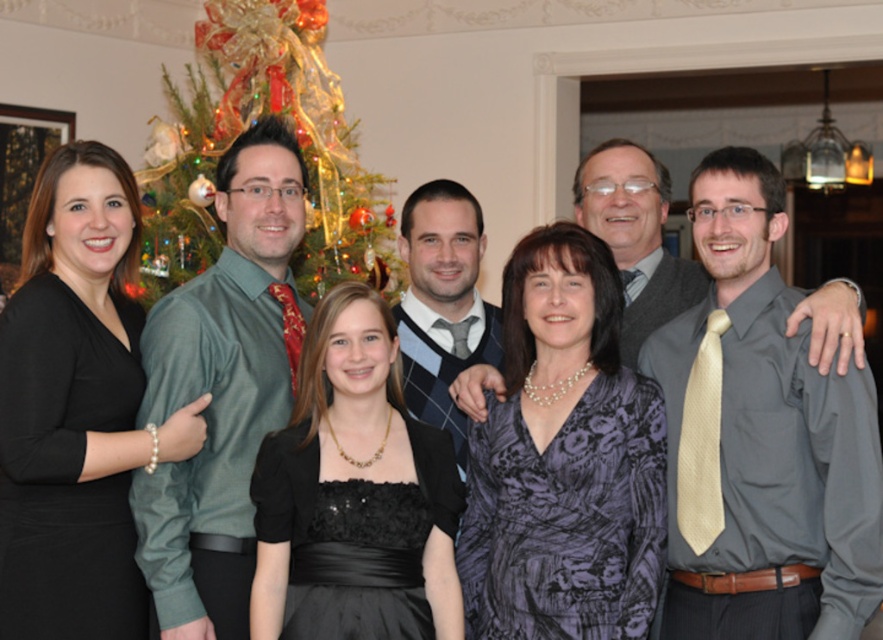
The width and height of the screenshot is (883, 640). What do you see at coordinates (223, 388) in the screenshot?
I see `green satin shirt at left` at bounding box center [223, 388].

Is green satin shirt at left positioned at the back of plaid sweater at center?

No.

You are a GUI agent. You are given a task and a screenshot of the screen. Output one action in this format:
    pyautogui.click(x=<x>, y=<y>)
    Task: Click on the green satin shirt at left
    The height and width of the screenshot is (640, 883).
    Given the screenshot: What is the action you would take?
    pyautogui.click(x=223, y=388)

Who is higher up, green satin shirt at left or decorated christmas tree at upper left?

decorated christmas tree at upper left

Between green satin shirt at left and decorated christmas tree at upper left, which one is positioned lower?

Positioned lower is green satin shirt at left.

Describe the element at coordinates (223, 388) in the screenshot. This screenshot has height=640, width=883. I see `green satin shirt at left` at that location.

Where is `green satin shirt at left`? green satin shirt at left is located at coordinates (223, 388).

Does point (765, 387) come closer to viewer compared to point (444, 381)?

Yes, point (765, 387) is in front of point (444, 381).

Who is shorter, silky gold tie at right or plaid sweater at center?

With less height is plaid sweater at center.

Describe the element at coordinates (760, 440) in the screenshot. The image size is (883, 640). I see `silky gold tie at right` at that location.

The height and width of the screenshot is (640, 883). I want to click on silky gold tie at right, so click(x=760, y=440).